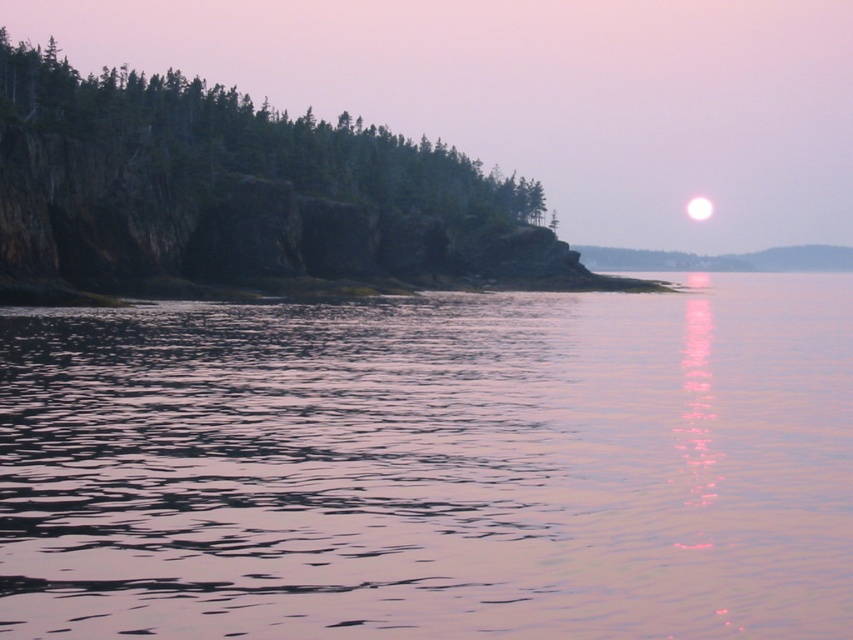
Which of these two, smooth water at center or white glossy moon at upper right, stands shorter?

With less height is smooth water at center.

Which is in front, point (410, 540) or point (708, 209)?

Point (410, 540) is in front.

At what (x,y) coordinates should I click in order to perform the action: click on smooth water at center. Please return your answer as a coordinate pair (x, y). Looking at the image, I should click on (433, 465).

Is green matte trees at upper left in front of white glossy moon at upper right?

Yes, green matte trees at upper left is in front of white glossy moon at upper right.

Measure the distance between green matte trees at upper left and camera.

green matte trees at upper left is 76.15 meters away from camera.

This screenshot has width=853, height=640. Identify the location of green matte trees at upper left. (253, 138).

Describe the element at coordinates (433, 465) in the screenshot. Image resolution: width=853 pixels, height=640 pixels. I see `smooth water at center` at that location.

Which of these two, smooth water at center or green matte trees at upper left, stands taller?

With more height is green matte trees at upper left.

This screenshot has height=640, width=853. In order to click on smooth water at center in this screenshot , I will do `click(433, 465)`.

Find the location of `smooth water at center`. smooth water at center is located at coordinates (433, 465).